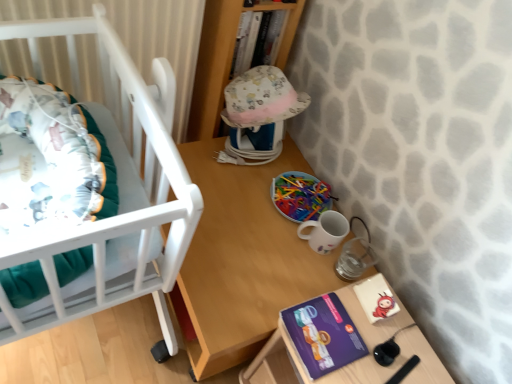
Question: Can you confirm if multicolored plastic sticks at center is positioned to the left of purple matte paperback book at lower right?

Choices:
 (A) yes
 (B) no

Answer: (A)

Question: From the image's perspective, is multicolored plastic sticks at center under purple matte paperback book at lower right?

Choices:
 (A) no
 (B) yes

Answer: (A)

Question: Is multicolored plastic sticks at center shorter than purple matte paperback book at lower right?

Choices:
 (A) no
 (B) yes

Answer: (B)

Question: Is the position of multicolored plastic sticks at center less distant than that of purple matte paperback book at lower right?

Choices:
 (A) no
 (B) yes

Answer: (A)

Question: Is multicolored plastic sticks at center bigger than purple matte paperback book at lower right?

Choices:
 (A) yes
 (B) no

Answer: (A)

Question: Considering the positions of multicolored plastic sticks at center and purple cardboard box at lower right in the image, is multicolored plastic sticks at center wider or thinner than purple cardboard box at lower right?

Choices:
 (A) wide
 (B) thin

Answer: (B)

Question: Considering their positions, is multicolored plastic sticks at center located in front of or behind purple cardboard box at lower right?

Choices:
 (A) front
 (B) behind

Answer: (B)

Question: Is point (293, 178) positioned closer to the camera than point (298, 355)?

Choices:
 (A) closer
 (B) farther

Answer: (B)

Question: From a real-world perspective, is multicolored plastic sticks at center above or below purple cardboard box at lower right?

Choices:
 (A) below
 (B) above

Answer: (B)

Question: Is hardcover book at upper center to the left or to the right of wooden table at center in the image?

Choices:
 (A) right
 (B) left

Answer: (A)

Question: From a real-world perspective, relative to wooden table at center, is hardcover book at upper center vertically above or below?

Choices:
 (A) below
 (B) above

Answer: (B)

Question: From the image's perspective, is hardcover book at upper center above or below wooden table at center?

Choices:
 (A) above
 (B) below

Answer: (A)

Question: Is point (251, 29) closer or farther from the camera than point (233, 316)?

Choices:
 (A) closer
 (B) farther

Answer: (B)

Question: Looking at their shapes, would you say white glossy mug at lower right is wider or thinner than purple cardboard box at lower right?

Choices:
 (A) thin
 (B) wide

Answer: (A)

Question: Is white glossy mug at lower right situated inside purple cardboard box at lower right or outside?

Choices:
 (A) outside
 (B) inside

Answer: (A)